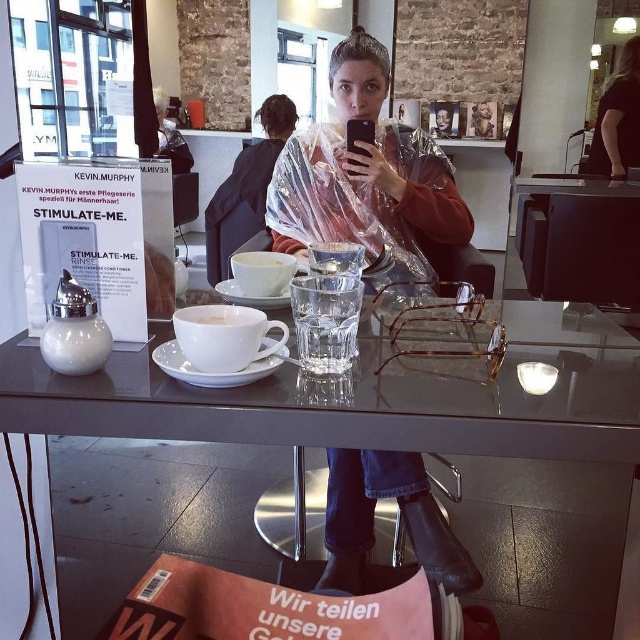
Question: Which object appears closest to the camera in this image?

Choices:
 (A) white ceramic cup at center
 (B) transparent plastic poncho at center

Answer: (A)

Question: Which object is closer to the camera taking this photo?

Choices:
 (A) transparent plastic poncho at center
 (B) white ceramic cup at center

Answer: (B)

Question: Is transparent plastic poncho at center bigger than white ceramic cup at center?

Choices:
 (A) yes
 (B) no

Answer: (A)

Question: Is transparent plastic poncho at center further to camera compared to white ceramic cup at center?

Choices:
 (A) no
 (B) yes

Answer: (B)

Question: Is transparent plastic poncho at center below white ceramic cup at center?

Choices:
 (A) no
 (B) yes

Answer: (A)

Question: Which object appears closest to the camera in this image?

Choices:
 (A) white ceramic cup at center
 (B) transparent plastic poncho at center

Answer: (A)